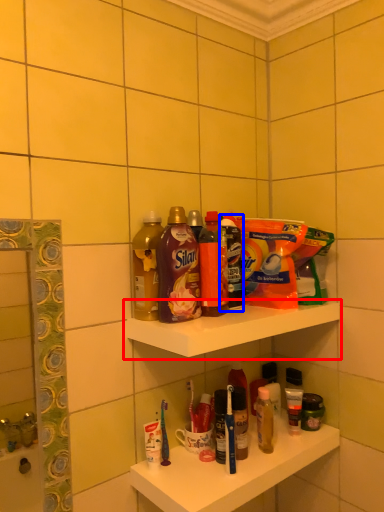
Question: Which of the following is the farthest to the observer, shelf (highlighted by a red box) or cleaning product (highlighted by a blue box)?

Choices:
 (A) shelf
 (B) cleaning product

Answer: (B)